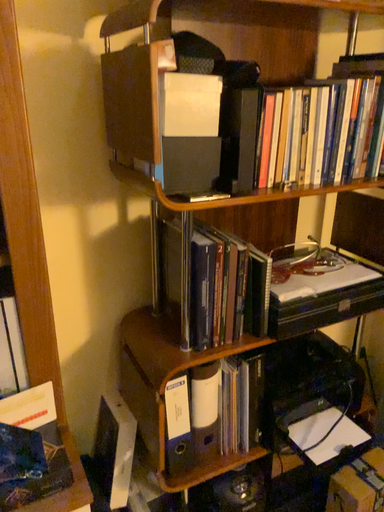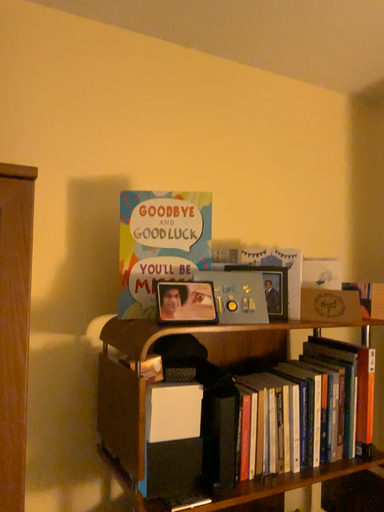
Question: How did the camera likely rotate when shooting the video?

Choices:
 (A) rotated upward
 (B) rotated downward

Answer: (A)